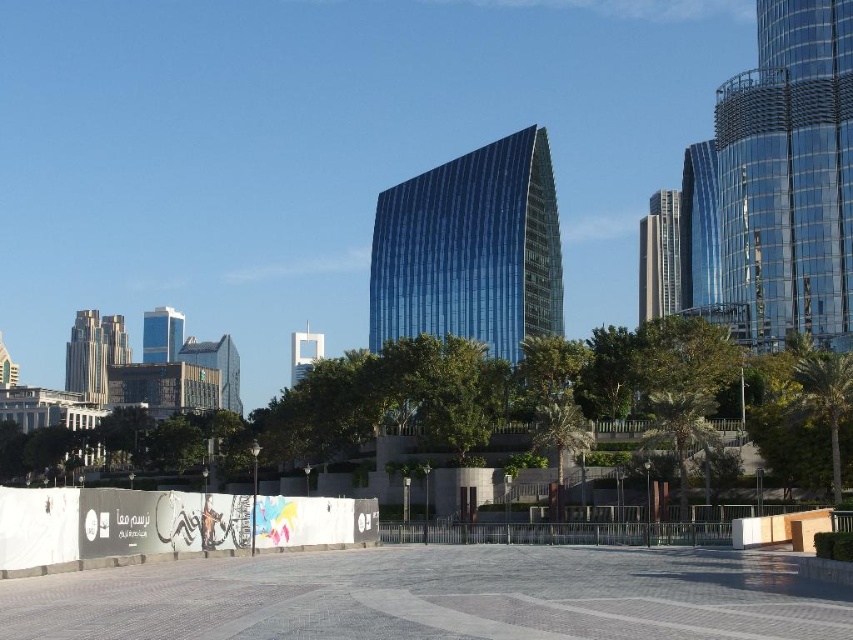
Which is below, shiny glass skyscraper at right or blue glass building at center?

blue glass building at center

Does shiny glass skyscraper at right appear on the left side of blue glass building at center?

In fact, shiny glass skyscraper at right is to the right of blue glass building at center.

The image size is (853, 640). Find the location of `shiny glass skyscraper at right`. shiny glass skyscraper at right is located at coordinates (780, 180).

Is point (665, 268) less distant than point (144, 355)?

Yes.

Which of these two, metallic glass skyscraper at right or glassy blue skyscraper at center, stands taller?

metallic glass skyscraper at right

Describe the element at coordinates (659, 257) in the screenshot. I see `metallic glass skyscraper at right` at that location.

Where is `metallic glass skyscraper at right`? metallic glass skyscraper at right is located at coordinates (659, 257).

How distant is glassy metallic skyscraper at center from glassy blue skyscraper at center?

They are 16.68 meters apart.

Describe the element at coordinates (218, 365) in the screenshot. The width and height of the screenshot is (853, 640). I see `glassy metallic skyscraper at center` at that location.

In order to click on glassy metallic skyscraper at center in this screenshot , I will do `click(218, 365)`.